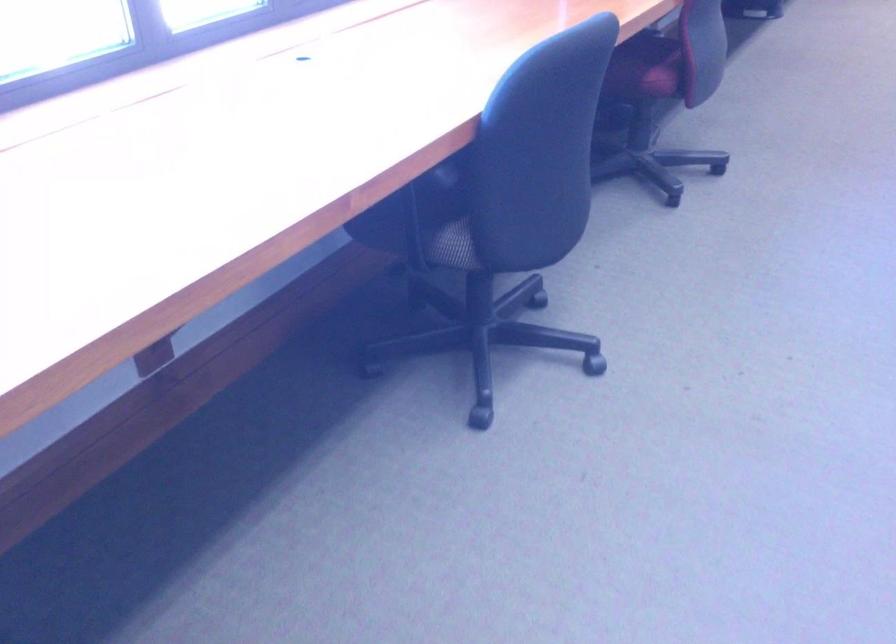
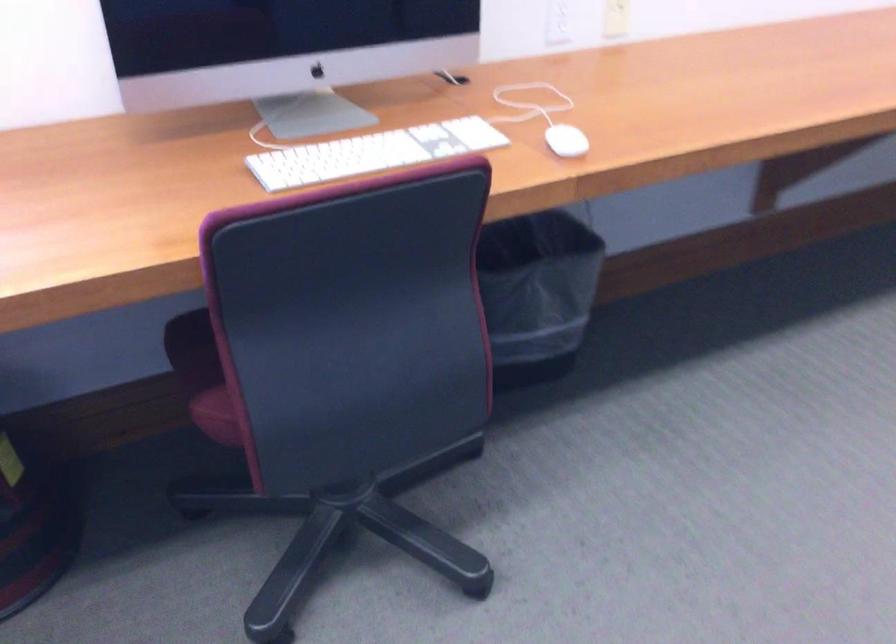
In the second image, find the point that corresponds to the point at 668,69 in the first image.

(220, 413)